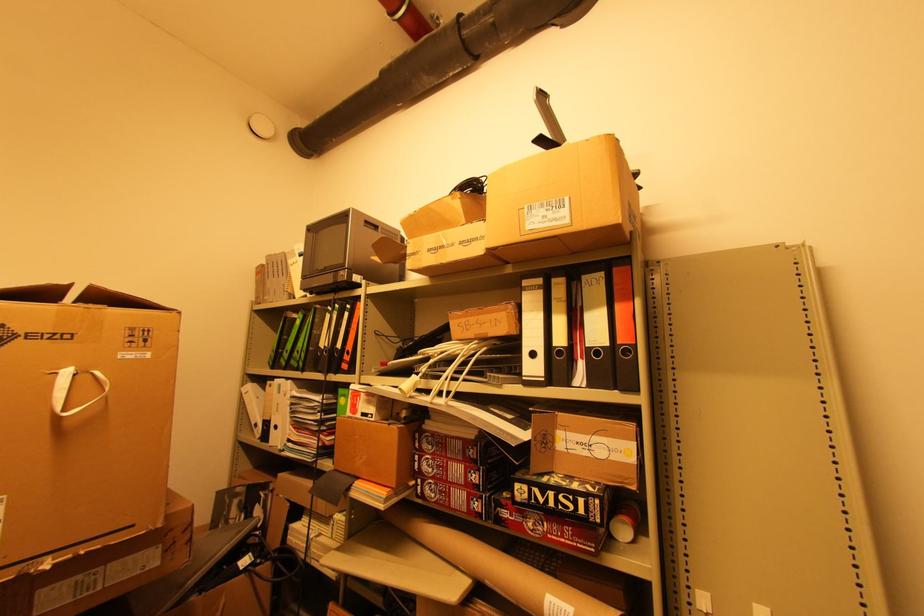
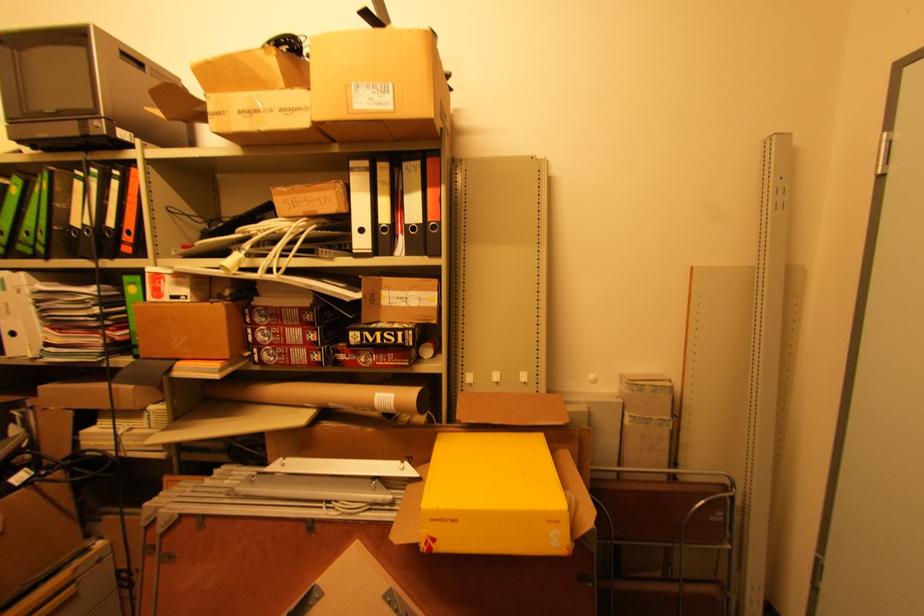
Question: I am providing you with two images of the same scene from different viewpoints. Which of the following objects are not visible in image2?

Choices:
 (A) red and black box
 (B) yellow cardboard box
 (C) white binder finger hole
 (D) none of these

Answer: (D)